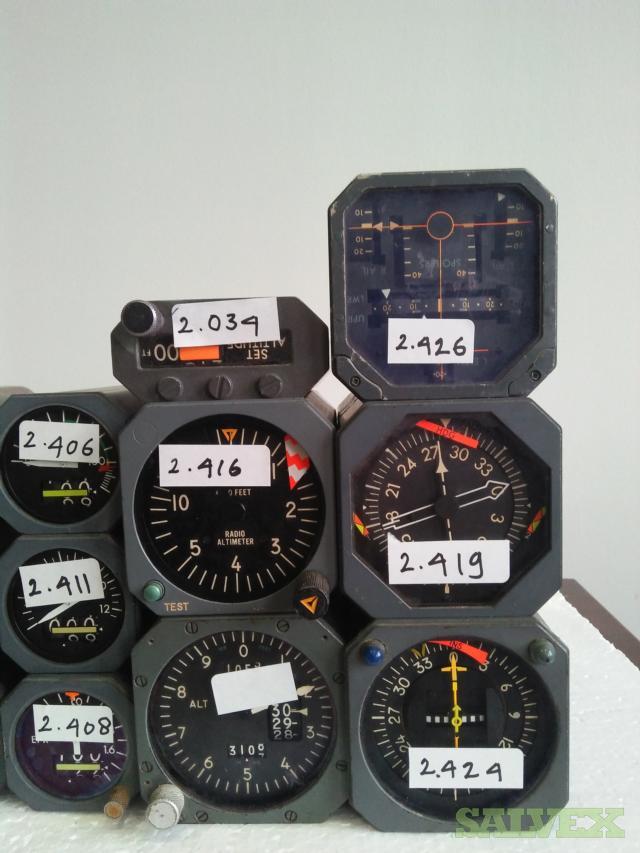
Find the location of `white wall`. white wall is located at coordinates (306, 21).